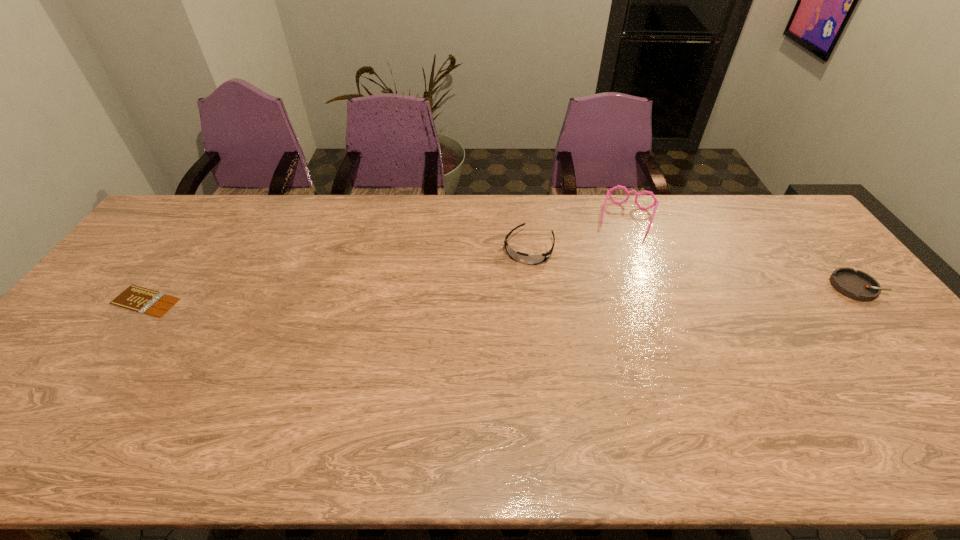
Locate an element on the screen. The width and height of the screenshot is (960, 540). free space at the far edge of the desktop is located at coordinates click(x=494, y=227).

In the image, there is a desktop. Find the location of `vacant space at the near edge`. vacant space at the near edge is located at coordinates (242, 400).

You are a GUI agent. You are given a task and a screenshot of the screen. Output one action in this format:
    pyautogui.click(x=<x>, y=<y>)
    Task: Click on the free space at the left edge of the desktop
    The width and height of the screenshot is (960, 540).
    Given the screenshot: What is the action you would take?
    pyautogui.click(x=139, y=246)

Locate an element on the screen. free space at the far left corner of the desktop is located at coordinates (180, 220).

In the image, there is a desktop. Where is `vacant area at the near left corner`? The height and width of the screenshot is (540, 960). vacant area at the near left corner is located at coordinates (66, 414).

You are a GUI agent. You are given a task and a screenshot of the screen. Output one action in this format:
    pyautogui.click(x=<x>, y=<y>)
    Task: Click on the vacant area that lies between the sunglasses and the second shortest object
    
    Given the screenshot: What is the action you would take?
    pyautogui.click(x=691, y=267)

I want to click on free point between the sunglasses and the chocolate bar, so click(x=337, y=275).

At what (x,y) coordinates should I click in order to perform the action: click on vacant area that lies between the third object from left to right and the second tallest object. Please return your answer as a coordinate pair (x, y). This screenshot has width=960, height=540. Looking at the image, I should click on (578, 233).

Identify the location of unoccupied area between the second object from right to left and the third object from right to left. (x=578, y=233).

Where is `empty space between the third object from left to right and the third shortest object`? Image resolution: width=960 pixels, height=540 pixels. empty space between the third object from left to right and the third shortest object is located at coordinates click(x=578, y=233).